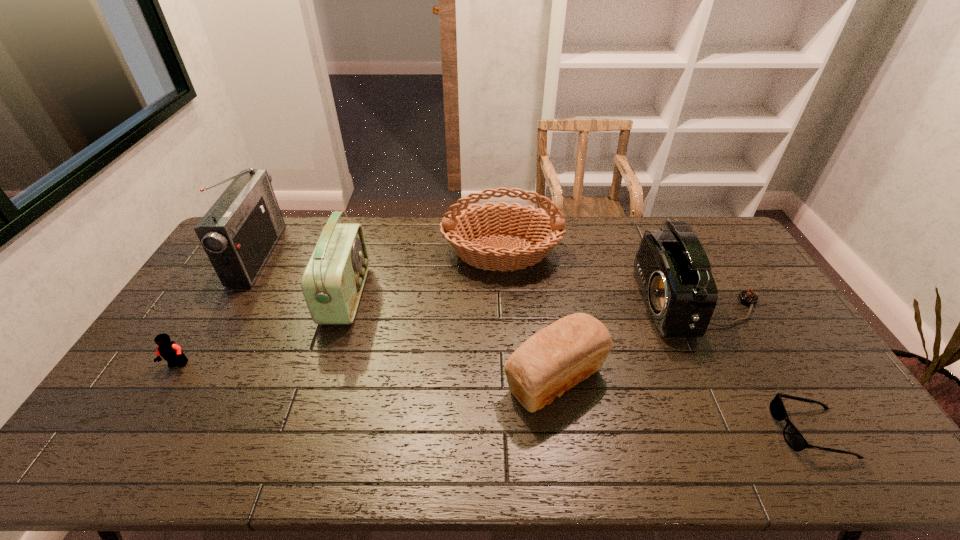
This screenshot has width=960, height=540. I want to click on free spot between the basket and the tallest object, so click(x=379, y=254).

Select which object appears as the closest to the basket. Please provide its 2D coordinates. Your answer should be formatted as a tuple, i.e. [(x, y)], where the tuple contains the x and y coordinates of a point satisfying the conditions above.

[(672, 268)]

Identify which object is the fifth closest to the basket. Please provide its 2D coordinates. Your answer should be formatted as a tuple, i.e. [(x, y)], where the tuple contains the x and y coordinates of a point satisfying the conditions above.

[(795, 440)]

Identify the location of radio receiver object that ranks as the closest to the leftmost radio receiver. This screenshot has height=540, width=960. (332, 283).

Locate an element on the screen. This screenshot has width=960, height=540. the second closest radio receiver to the tallest object is located at coordinates (672, 268).

Where is `vacant area in the image that satisfies the following two spatial constraints: 1. on the front-facing side of the rightmost radio receiver; 2. on the front-facing side of the sixth tallest object`? The width and height of the screenshot is (960, 540). vacant area in the image that satisfies the following two spatial constraints: 1. on the front-facing side of the rightmost radio receiver; 2. on the front-facing side of the sixth tallest object is located at coordinates (732, 365).

At what (x,y) coordinates should I click in order to perform the action: click on free spot that satisfies the following two spatial constraints: 1. on the front panel of the second radio receiver from right to left; 2. on the front-facing side of the sixth tallest object. Please return your answer as a coordinate pair (x, y). The image size is (960, 540). Looking at the image, I should click on (324, 365).

Locate an element on the screen. The width and height of the screenshot is (960, 540). free location that satisfies the following two spatial constraints: 1. on the back side of the fifth tallest object; 2. on the front panel of the fifth object from right to left is located at coordinates (542, 295).